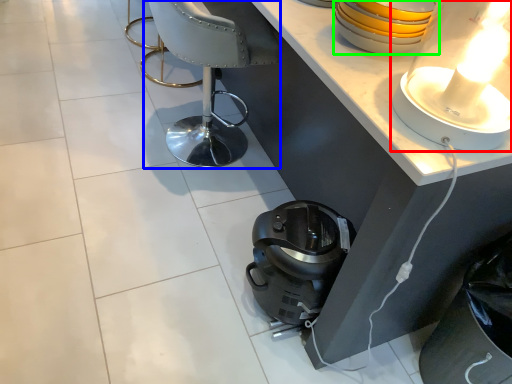
Question: Which is nearer to the lamp (highlighted by a red box)? armchair (highlighted by a blue box) or appliance (highlighted by a green box).

Choices:
 (A) armchair
 (B) appliance

Answer: (B)